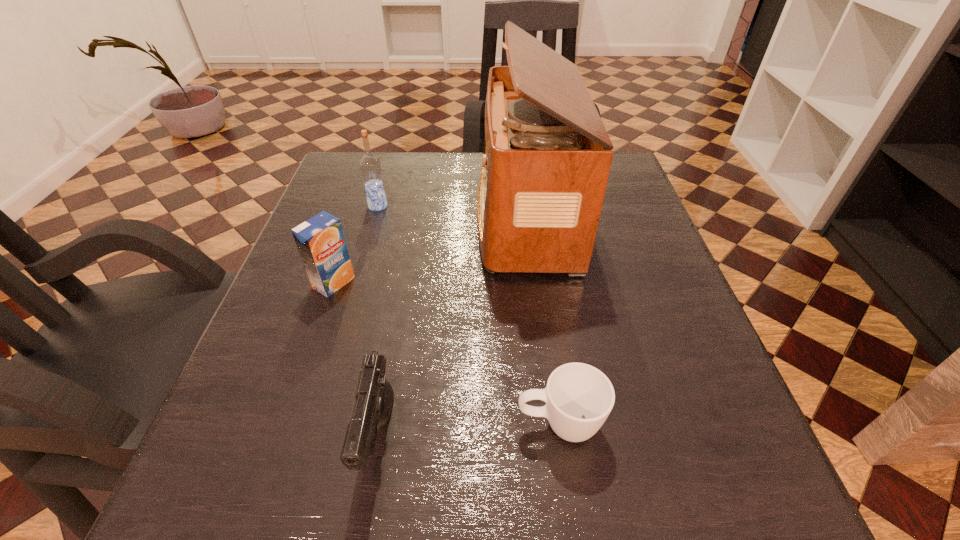
Locate an element on the screen. Image resolution: width=960 pixels, height=540 pixels. blank space at the far edge of the desktop is located at coordinates (464, 176).

Locate an element on the screen. Image resolution: width=960 pixels, height=540 pixels. vacant area at the near edge is located at coordinates (502, 509).

In the image, there is a desktop. Identify the location of vacant space at the left edge. This screenshot has height=540, width=960. (292, 292).

In the image, there is a desktop. At what (x,y) coordinates should I click in order to perform the action: click on free space at the right edge. Please return your answer as a coordinate pair (x, y). Looking at the image, I should click on (653, 241).

In the image, there is a desktop. Where is `blank space at the far left corner`? blank space at the far left corner is located at coordinates (348, 190).

In the image, there is a desktop. Where is `free space at the far right corner`? The width and height of the screenshot is (960, 540). free space at the far right corner is located at coordinates (611, 179).

This screenshot has width=960, height=540. In order to click on free space between the pistol and the shortest object in this screenshot , I will do `click(469, 431)`.

I want to click on vacant space that is in between the orange_juice and the fourth shortest object, so click(356, 245).

This screenshot has height=540, width=960. I want to click on free spot between the second shortest object and the cup, so click(x=469, y=431).

Find the location of a particular element. blank region between the shortest object and the radio receiver is located at coordinates (542, 320).